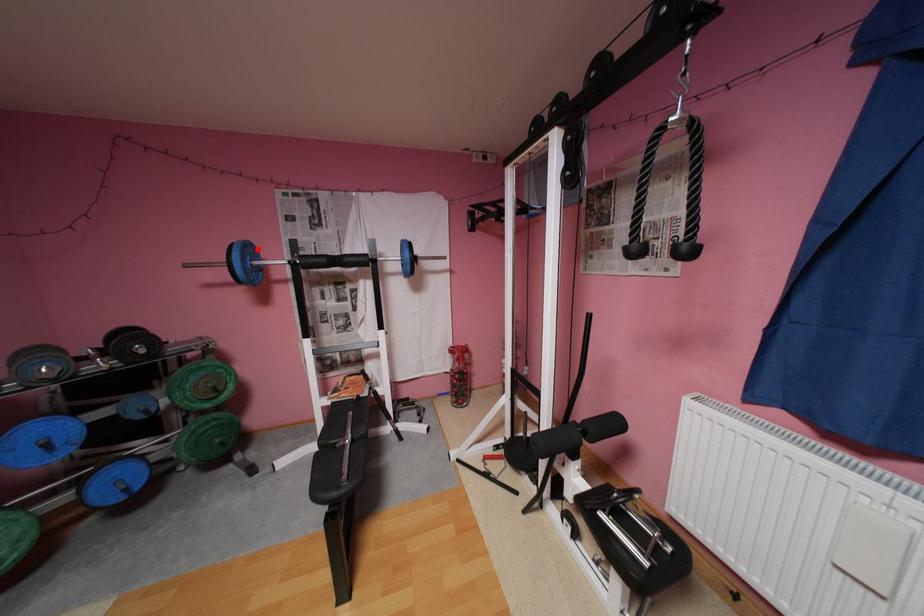
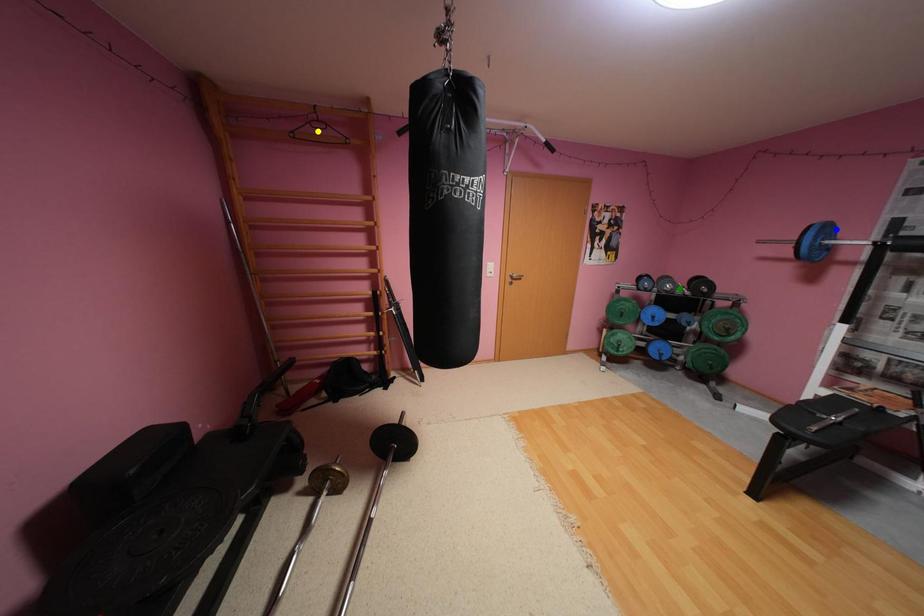
Question: I am providing you with two images of the same scene from different viewpoints. A red point is marked on the first image. You are given multiple points on the second image. Which mark in image 2 goes with the point in image 1?

Choices:
 (A) yellow point
 (B) blue point
 (C) green point

Answer: (B)